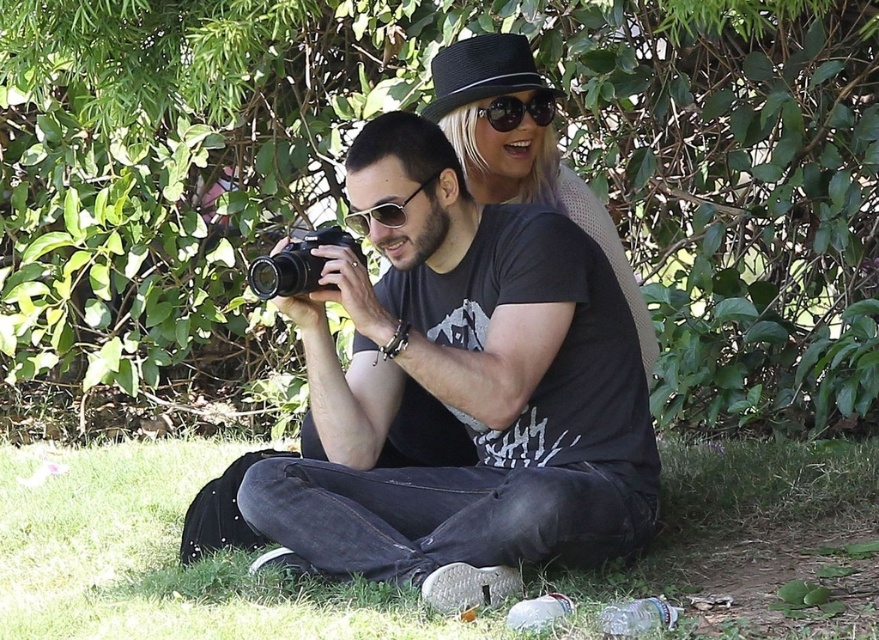
Question: Among these objects, which one is farthest from the camera?

Choices:
 (A) black reflective sunglasses at upper center
 (B) satin black hat at upper center
 (C) sunglasses at center
 (D) black matte camera at center

Answer: (A)

Question: Is satin black hat at upper center smaller than black plastic camera at center?

Choices:
 (A) yes
 (B) no

Answer: (B)

Question: Among these points, which one is nearest to the camera?

Choices:
 (A) (391, 204)
 (B) (654, 449)
 (C) (863, 19)

Answer: (A)

Question: Can you confirm if green grass at lower center is positioned to the left of black plastic camera at center?

Choices:
 (A) yes
 (B) no

Answer: (A)

Question: Which is nearer to the sunglasses at center?

Choices:
 (A) black reflective sunglasses at upper center
 (B) satin black hat at upper center
 (C) black matte camera at center
 (D) green grass at lower center

Answer: (C)

Question: Can you confirm if green leafy tree at center is smaller than black matte camera at center?

Choices:
 (A) no
 (B) yes

Answer: (A)